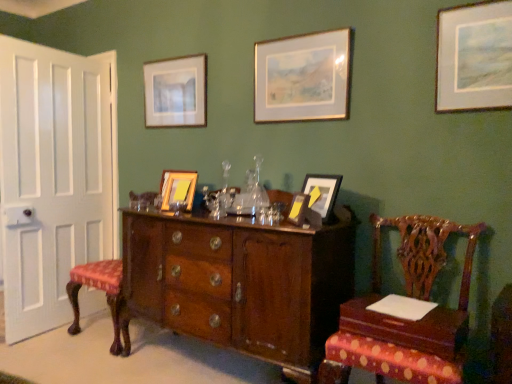
Question: Does point (330, 200) appear closer or farther from the camera than point (188, 114)?

Choices:
 (A) farther
 (B) closer

Answer: (B)

Question: Is matte brown picture frame at center, which is the third picture frame in front-to-back order, situated inside matte wooden picture frame at upper center, which ranks as the first picture frame in back-to-front order, or outside?

Choices:
 (A) outside
 (B) inside

Answer: (A)

Question: Which of these objects is positioned farthest from the polished wood chair at right, positioned as the first chair in front-to-back order?

Choices:
 (A) matte gray picture frame at upper right, which appears as the 1th picture frame when viewed from the right
 (B) matte wooden picture frame at upper center, the 1th picture frame positioned from the left
 (C) matte gold picture frame at center, the second picture frame from the front
 (D) wooden table at lower right
 (E) wooden picture frame at center, placed as the fifth picture frame when sorted from front to back

Answer: (B)

Question: Which of these objects is positioned farthest from the matte gold picture frame at center, the fifth picture frame viewed from the back?

Choices:
 (A) wooden table at lower right
 (B) polished wood chair at right, acting as the 2th chair starting from the left
 (C) polished wood cabinet at center
 (D) white wood door at left
 (E) matte wooden picture frame at upper center, marked as the 6th picture frame in a right-to-left arrangement

Answer: (D)